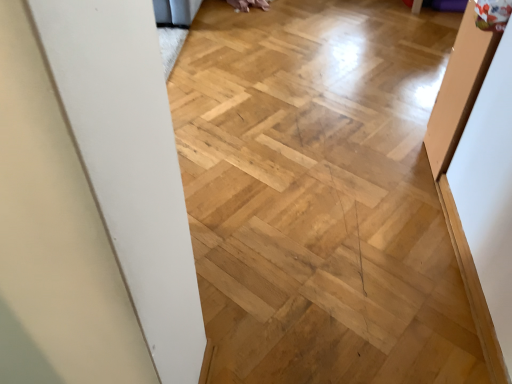
Locate an element on the screen. vacant region to the left of light brown wood door at upper right is located at coordinates (396, 160).